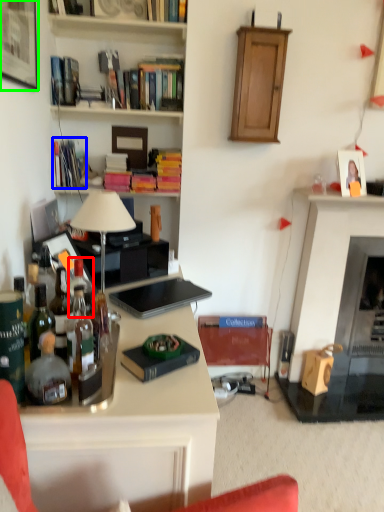
Question: Considering the real-world distances, which object is closest to bottle (highlighted by a red box)? book (highlighted by a blue box) or picture frame (highlighted by a green box).

Choices:
 (A) book
 (B) picture frame

Answer: (B)